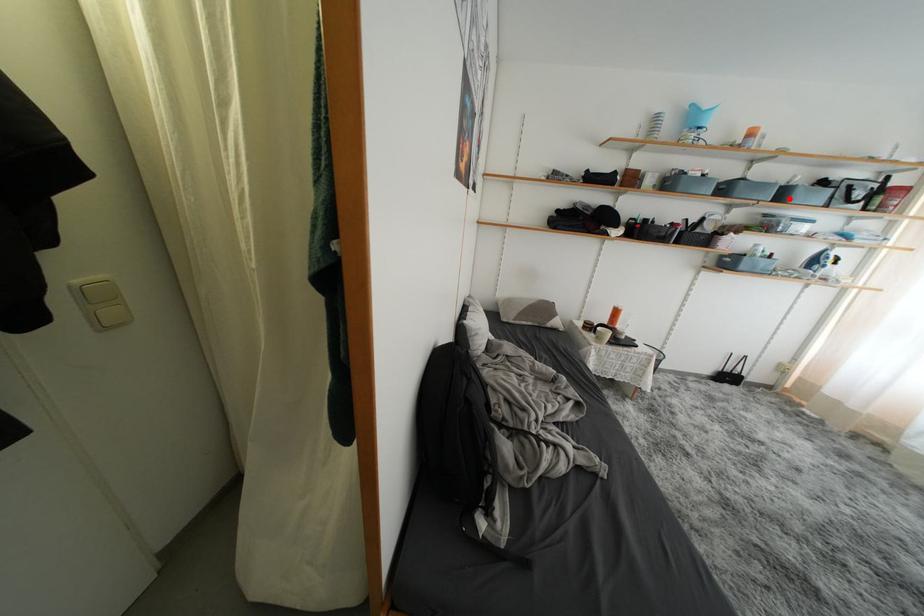
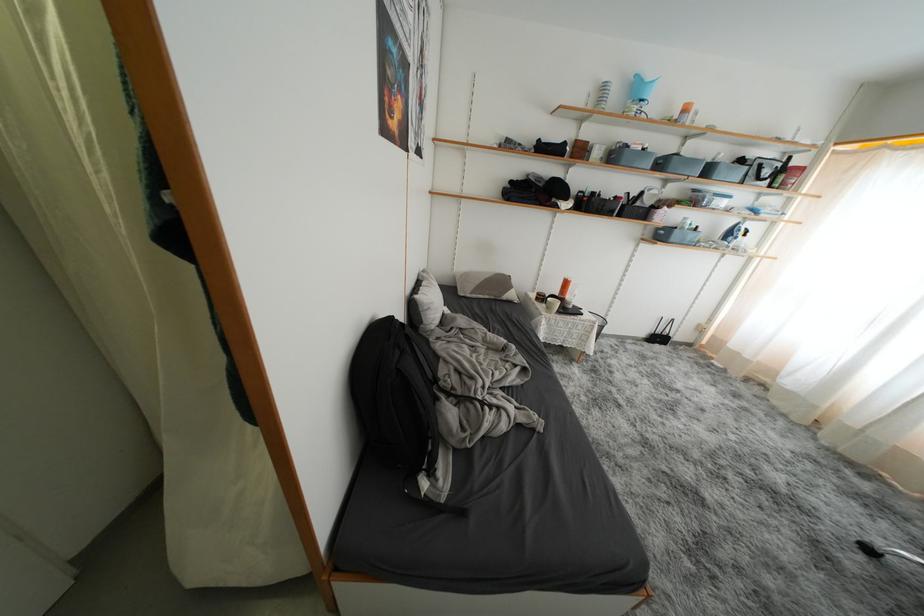
Question: I am providing you with two images of the same scene from different viewpoints. In image1, a red point is highlighted. Considering the same 3D point in image2, which of the following is correct?

Choices:
 (A) It is closer
 (B) It is farther

Answer: (A)